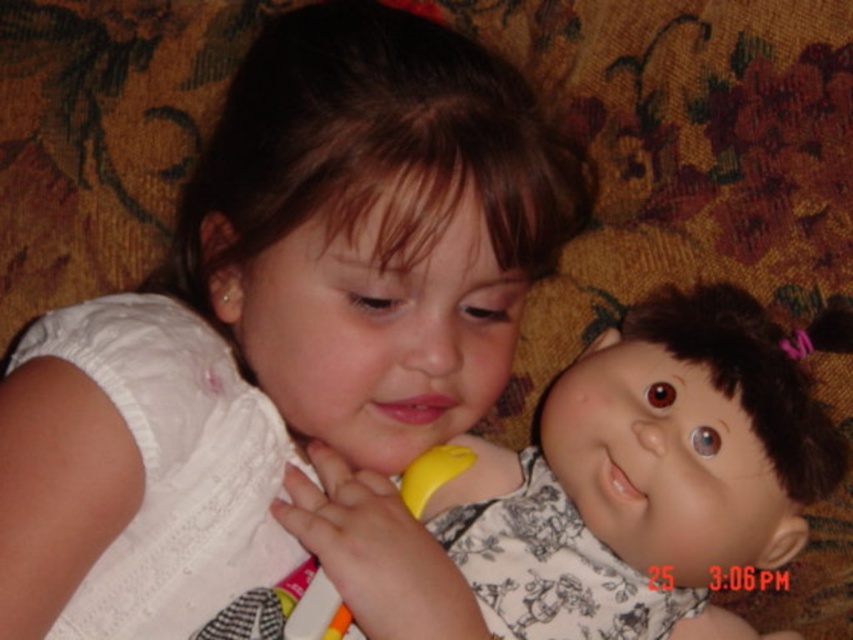
Is white fabric dress at center below smooth plastic doll at center?

No.

Can you confirm if white fabric dress at center is taller than smooth plastic doll at center?

Indeed, white fabric dress at center has a greater height compared to smooth plastic doll at center.

The width and height of the screenshot is (853, 640). What do you see at coordinates (294, 289) in the screenshot? I see `white fabric dress at center` at bounding box center [294, 289].

Locate an element on the screen. The image size is (853, 640). white fabric dress at center is located at coordinates (294, 289).